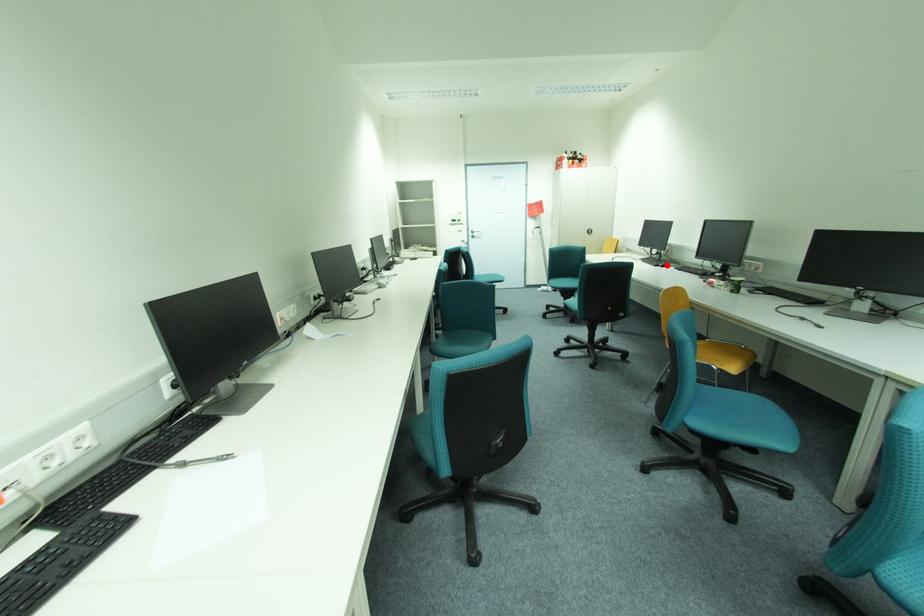
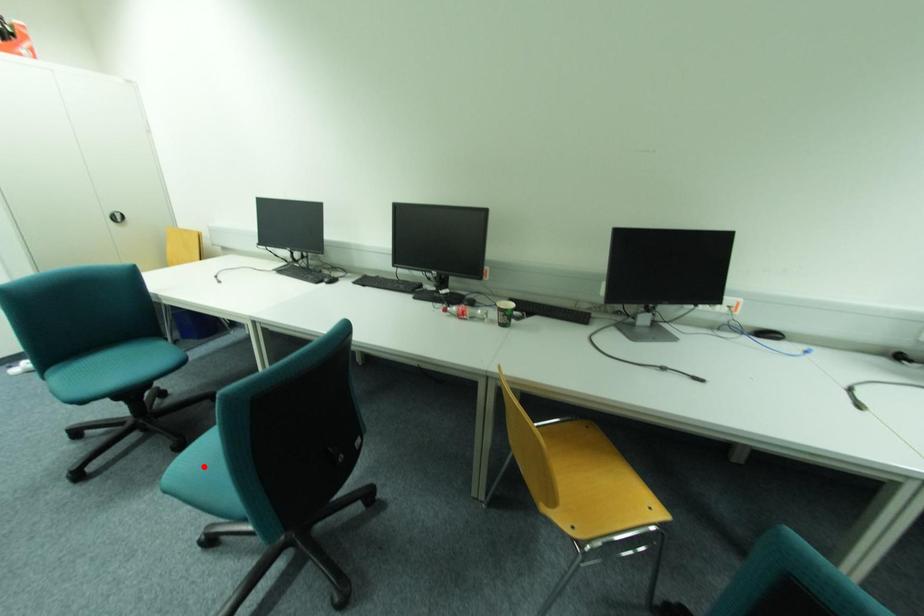
I am providing you with two images of the same scene from different viewpoints. A red point is marked on the first image and another point is marked on the second image. Does the point marked in image1 correspond to the same location as the one in image2?

No